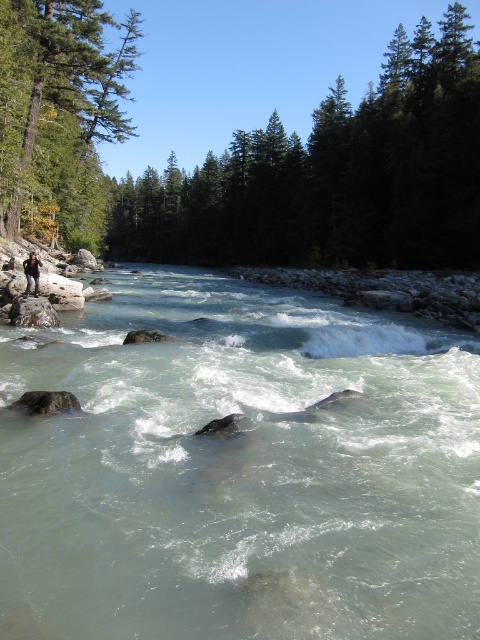
Question: Which object is farther from the camera taking this photo?

Choices:
 (A) green matte tree at upper left
 (B) clear water at stream left
 (C) green coniferous trees at upper center
 (D) camouflage fabric backpack at lower left

Answer: (C)

Question: Is green coniferous trees at upper center below green matte tree at upper left?

Choices:
 (A) no
 (B) yes

Answer: (A)

Question: Does green coniferous trees at upper center have a smaller size compared to green matte tree at upper left?

Choices:
 (A) no
 (B) yes

Answer: (A)

Question: Does green coniferous trees at upper center have a smaller size compared to green matte tree at upper left?

Choices:
 (A) no
 (B) yes

Answer: (A)

Question: Which object is the farthest from the clear water at stream left?

Choices:
 (A) green coniferous trees at upper center
 (B) green matte tree at upper left
 (C) camouflage fabric backpack at lower left

Answer: (A)

Question: Estimate the real-world distances between objects in this image. Which object is closer to the green coniferous trees at upper center?

Choices:
 (A) clear water at stream left
 (B) camouflage fabric backpack at lower left

Answer: (A)